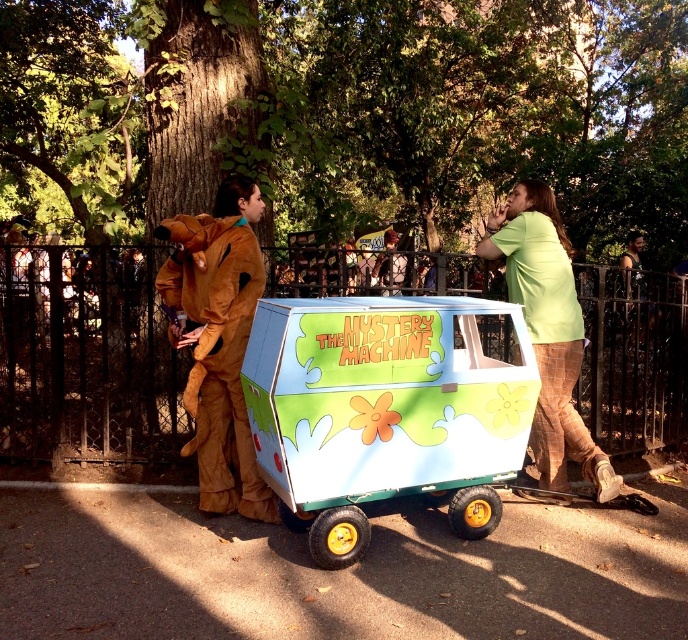
Question: Which object is closer to the camera taking this photo?

Choices:
 (A) green painted wood mystery machine at center
 (B) green plaid pants at right

Answer: (A)

Question: Can you confirm if green painted wood mystery machine at center is positioned to the right of brown furry costume at center?

Choices:
 (A) yes
 (B) no

Answer: (A)

Question: Does green painted wood mystery machine at center have a greater width compared to brown furry costume at center?

Choices:
 (A) no
 (B) yes

Answer: (B)

Question: Which point is closer to the camera taking this photo?

Choices:
 (A) (537, 445)
 (B) (230, 182)
 (C) (308, 524)

Answer: (C)

Question: Can you confirm if brown furry costume at center is thinner than green plaid pants at right?

Choices:
 (A) no
 (B) yes

Answer: (B)

Question: Considering the real-world distances, which object is closest to the green plaid pants at right?

Choices:
 (A) green painted wood mystery machine at center
 (B) brown furry costume at center

Answer: (A)